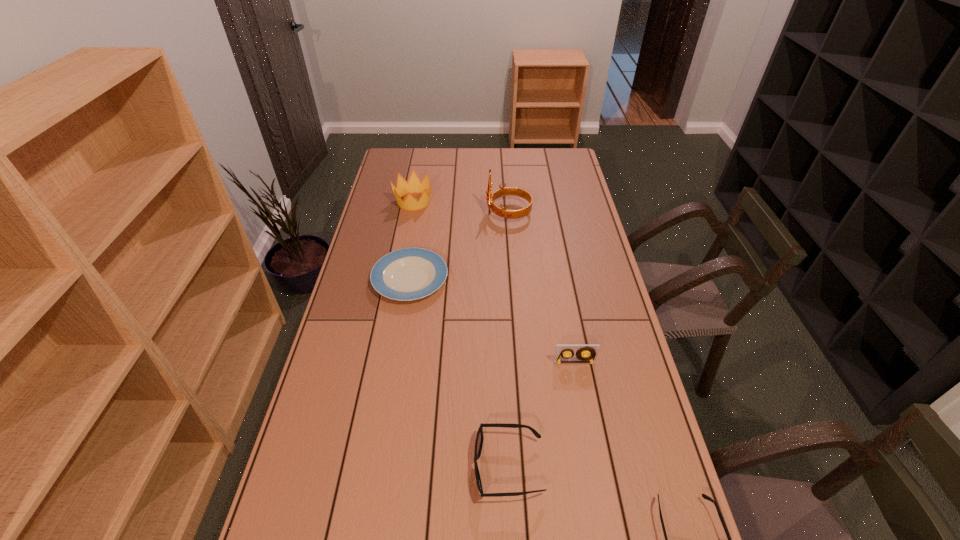
The width and height of the screenshot is (960, 540). Find the location of `vacant point located between the third shortest object and the fourth nearest object`. vacant point located between the third shortest object and the fourth nearest object is located at coordinates (459, 373).

The height and width of the screenshot is (540, 960). Find the location of `unoccupied position between the fourth farthest object and the plate`. unoccupied position between the fourth farthest object and the plate is located at coordinates (492, 321).

At what (x,y) coordinates should I click in order to perform the action: click on free space between the third tallest object and the taller sunglasses. Please return your answer as a coordinate pair (x, y). Image resolution: width=960 pixels, height=540 pixels. Looking at the image, I should click on click(x=541, y=415).

Identify the location of object that stands as the closest to the third farthest object. (503, 191).

Identify which object is the fifth closest to the taller sunglasses. Please provide its 2D coordinates. Your answer should be formatted as a tuple, i.e. [(x, y)], where the tuple contains the x and y coordinates of a point satisfying the conditions above.

[(414, 185)]

This screenshot has height=540, width=960. I want to click on free space that satisfies the following two spatial constraints: 1. at the front of the fourth shortest object with visible reels; 2. on the front-facing side of the third shortest object, so click(x=593, y=467).

You are a GUI agent. You are given a task and a screenshot of the screen. Output one action in this format:
    pyautogui.click(x=<x>, y=<y>)
    Task: Click on the free space that satisfies the following two spatial constraints: 1. on the front side of the plate; 2. on the left side of the crown
    This screenshot has height=540, width=960.
    Given the screenshot: What is the action you would take?
    pyautogui.click(x=399, y=279)

This screenshot has width=960, height=540. I want to click on vacant point that satisfies the following two spatial constraints: 1. at the front of the fourth farthest object with visible reels; 2. on the front-facing side of the third shortest object, so click(x=593, y=467).